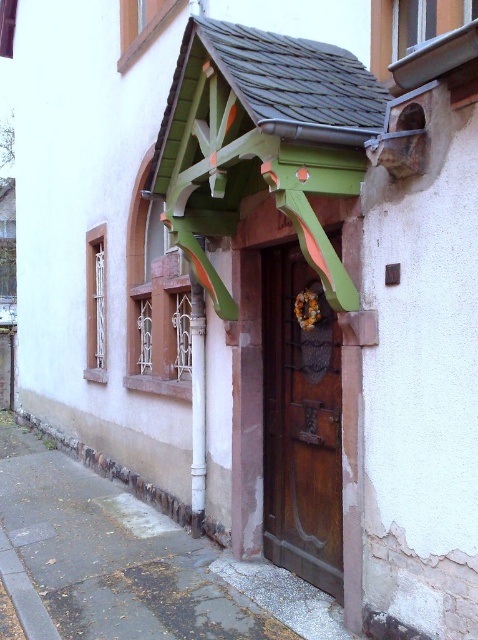
Can you confirm if brown wooden door at center is positioned above white painted wood at center?

Indeed, brown wooden door at center is positioned over white painted wood at center.

Is point (262, 260) positioned behind point (192, 392)?

No, (262, 260) is in front of (192, 392).

Find the location of `brown wooden door at center`. brown wooden door at center is located at coordinates (301, 420).